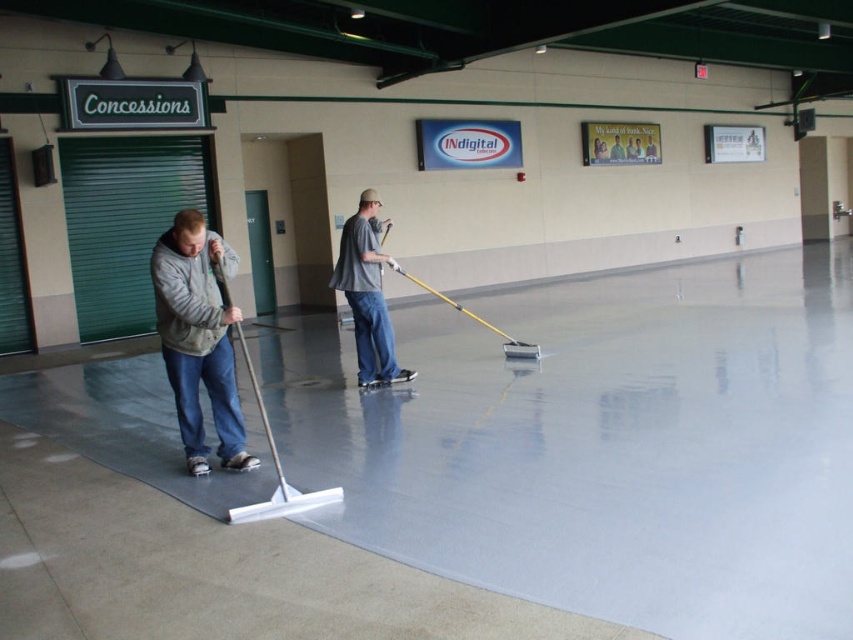
Question: Based on their relative distances, which object is nearer to the gray matte shirt at center?

Choices:
 (A) smooth gray concrete at center
 (B) gray fleece jacket at left

Answer: (B)

Question: Which point is closer to the camera?

Choices:
 (A) smooth gray concrete at center
 (B) gray matte shirt at center

Answer: (A)

Question: In this image, where is smooth gray concrete at center located relative to gray fleece jacket at left?

Choices:
 (A) below
 (B) above

Answer: (A)

Question: Is gray fleece jacket at left bigger than gray matte shirt at center?

Choices:
 (A) no
 (B) yes

Answer: (A)

Question: Based on their relative distances, which object is farther from the smooth gray concrete at center?

Choices:
 (A) gray fleece jacket at left
 (B) gray matte shirt at center

Answer: (A)

Question: Where is smooth gray concrete at center located in relation to gray matte shirt at center in the image?

Choices:
 (A) left
 (B) right

Answer: (B)